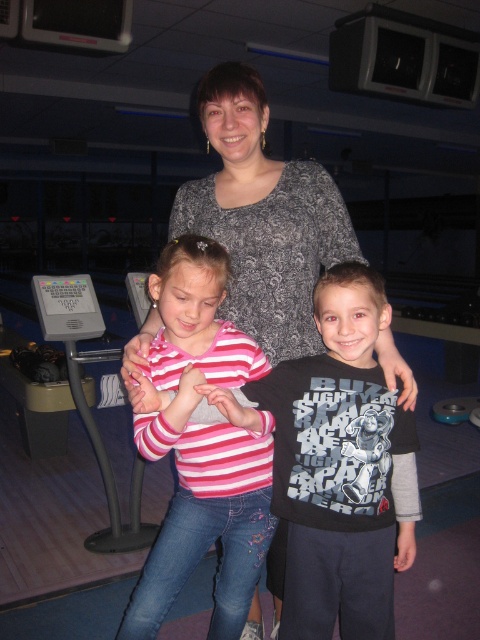
Question: Among these points, which one is farthest from the camera?

Choices:
 (A) (264, 298)
 (B) (168, 531)

Answer: (A)

Question: Which object is closer to the camera taking this photo?

Choices:
 (A) pink striped shirt at center
 (B) black cotton shirt at center

Answer: (B)

Question: Does black cotton shirt at center have a larger size compared to dark gray textured sweater at center?

Choices:
 (A) yes
 (B) no

Answer: (B)

Question: Is black cotton shirt at center above dark gray textured sweater at center?

Choices:
 (A) yes
 (B) no

Answer: (B)

Question: Estimate the real-world distances between objects in this image. Which object is farther from the dark gray textured sweater at center?

Choices:
 (A) pink striped shirt at center
 (B) black cotton shirt at center

Answer: (A)

Question: Where is black cotton shirt at center located in relation to pink striped shirt at center in the image?

Choices:
 (A) right
 (B) left

Answer: (A)